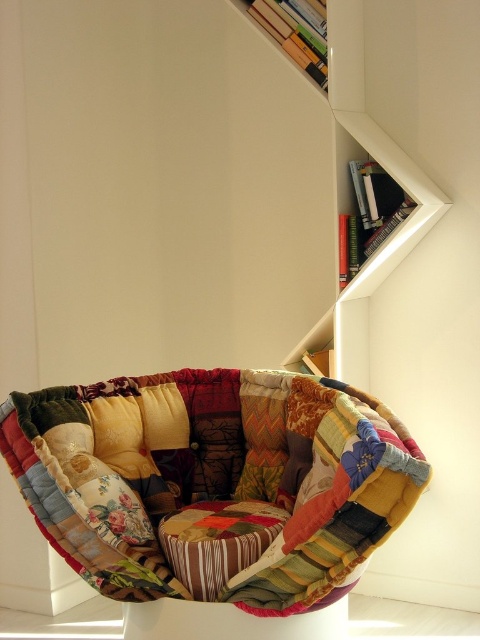
You are standing in a room with a hanging chair and a bookshelf. You want to place a new book on the point at coordinates point (154, 486). If your arm can reach up to 1.8 meters, can you reach that point?

The point (154, 486) is 2.07 meters from the viewer, which is beyond your arm reach of 1.8 meters. You cannot reach it.

You are standing in the room and want to sit on the patchwork fabric cushion at center. Where should you look to find it?

The patchwork fabric cushion at center is located at point coordinates of (213, 483).

In the scene shown: You are an interior designer planning to place a new decorative item in the room. The item is 1 meter in width. You have two options from the image to consider for placement space. Which object between the patchwork fabric cushion at center and the wooden bookshelf at upper right would you choose to place the item next to, based on their sizes?

The patchwork fabric cushion at center is bigger than the wooden bookshelf at upper right, so placing the 1 meter wide decorative item next to the patchwork fabric cushion at center would provide more space and better compatibility with the item size.